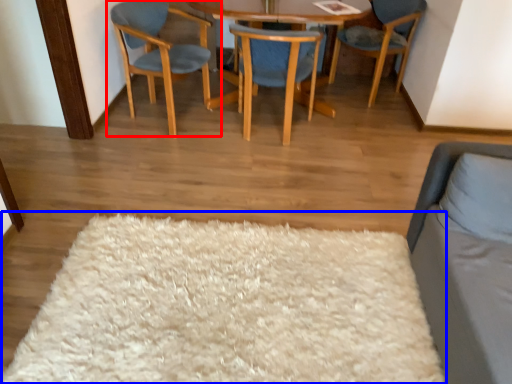
Question: Which point is closer to the camera, chair (highlighted by a red box) or mat (highlighted by a blue box)?

Choices:
 (A) chair
 (B) mat

Answer: (B)